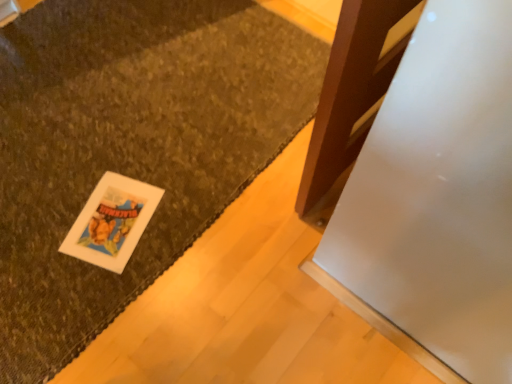
The image size is (512, 384). Identify the location of vacant space situated on the left part of white matte card at lower left. (33, 254).